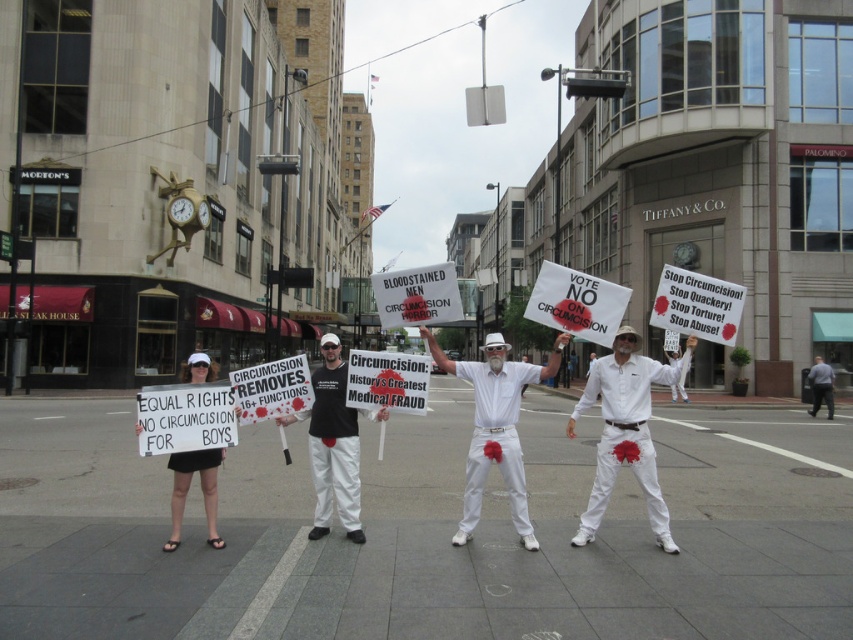
Which is behind, point (496, 376) or point (207, 508)?

The point (496, 376) is behind.

How distant is white cotton shirt at center from white fabric sign at lower left?

white cotton shirt at center is 10.21 feet away from white fabric sign at lower left.

The image size is (853, 640). What are the coordinates of `white cotton shirt at center` in the screenshot? It's located at (495, 426).

Is white paper sign at center shorter than gray fabric pants at lower right?

Correct, white paper sign at center is not as tall as gray fabric pants at lower right.

Image resolution: width=853 pixels, height=640 pixels. Find the location of `white paper sign at center`. white paper sign at center is located at coordinates (387, 380).

I want to click on white paper sign at center, so click(387, 380).

Describe the element at coordinates (332, 444) in the screenshot. I see `black cotton t-shirt at center` at that location.

Is point (347, 428) less distant than point (405, 394)?

That is True.

I want to click on black cotton t-shirt at center, so click(x=332, y=444).